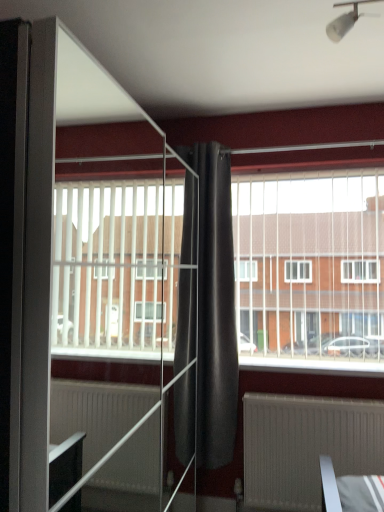
Question: From the image's perspective, is white plastic blinds at center located beneath white plastic light fixture at upper center?

Choices:
 (A) no
 (B) yes

Answer: (B)

Question: Does white plastic blinds at center have a smaller size compared to white plastic light fixture at upper center?

Choices:
 (A) yes
 (B) no

Answer: (B)

Question: Is white plastic blinds at center shorter than white plastic light fixture at upper center?

Choices:
 (A) no
 (B) yes

Answer: (A)

Question: Is white plastic blinds at center oriented away from white plastic light fixture at upper center?

Choices:
 (A) yes
 (B) no

Answer: (B)

Question: Is white plastic blinds at center outside of white plastic light fixture at upper center?

Choices:
 (A) yes
 (B) no

Answer: (A)

Question: Is white plastic blinds at center aimed at white plastic light fixture at upper center?

Choices:
 (A) yes
 (B) no

Answer: (A)

Question: Does white plastic blinds at center appear on the left side of matte gray radiator at lower center?

Choices:
 (A) no
 (B) yes

Answer: (A)

Question: Considering the relative sizes of white plastic blinds at center and matte gray radiator at lower center in the image provided, is white plastic blinds at center smaller than matte gray radiator at lower center?

Choices:
 (A) yes
 (B) no

Answer: (B)

Question: Is white plastic blinds at center bigger than matte gray radiator at lower center?

Choices:
 (A) yes
 (B) no

Answer: (A)

Question: Does white plastic blinds at center lie behind matte gray radiator at lower center?

Choices:
 (A) no
 (B) yes

Answer: (B)

Question: Are white plastic blinds at center and matte gray radiator at lower center located far from each other?

Choices:
 (A) no
 (B) yes

Answer: (A)

Question: Does white plastic blinds at center have a greater width compared to matte gray radiator at lower center?

Choices:
 (A) yes
 (B) no

Answer: (A)

Question: From the image's perspective, is matte gray radiator at lower center above transparent glass screen door at center?

Choices:
 (A) yes
 (B) no

Answer: (B)